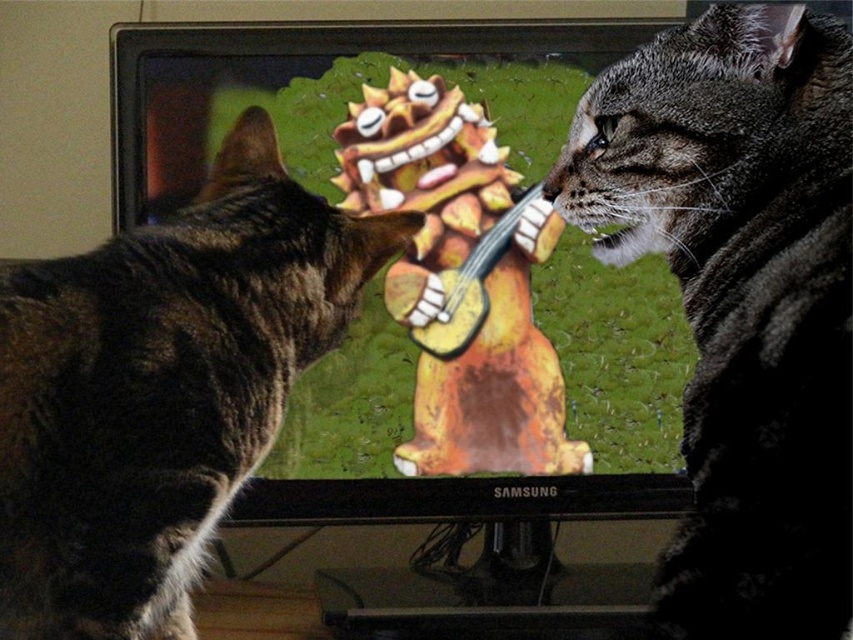
Question: Does tabby fur cat at left appear on the left side of wooden guitar at center?

Choices:
 (A) no
 (B) yes

Answer: (B)

Question: Does tabby fur cat at left have a greater width compared to wooden guitar at center?

Choices:
 (A) yes
 (B) no

Answer: (A)

Question: Which point is closer to the camera taking this photo?

Choices:
 (A) (282, 285)
 (B) (688, 179)
 (C) (480, 417)

Answer: (B)

Question: Which point is farther to the camera?

Choices:
 (A) wooden guitar at center
 (B) tabby fur cat at left
 (C) tabby fur cat at right

Answer: (A)

Question: Is tabby fur cat at right smaller than wooden guitar at center?

Choices:
 (A) no
 (B) yes

Answer: (A)

Question: Which point appears closest to the camera in this image?

Choices:
 (A) pyautogui.click(x=491, y=195)
 (B) pyautogui.click(x=233, y=128)

Answer: (B)